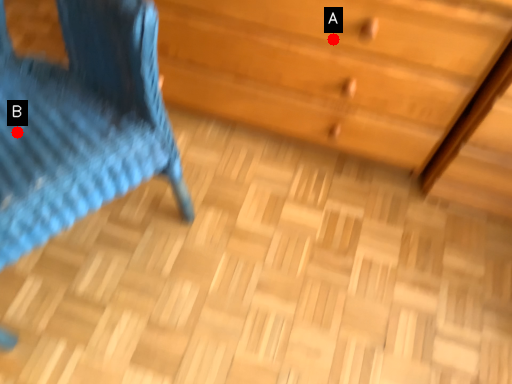
Question: Two points are circled on the image, labeled by A and B beside each circle. Among these points, which one is farthest from the camera?

Choices:
 (A) A is further
 (B) B is further

Answer: (A)